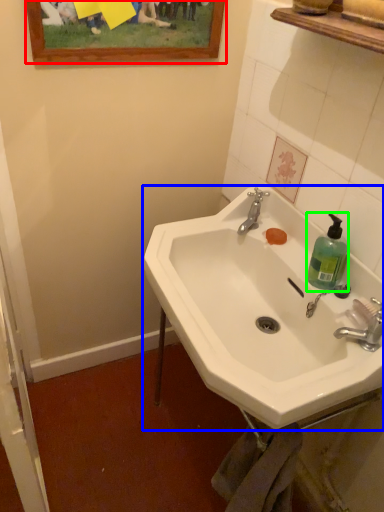
Question: Which is farther away from picture frame (highlighted by a red box)? sink (highlighted by a blue box) or soap dispenser (highlighted by a green box)?

Choices:
 (A) sink
 (B) soap dispenser

Answer: (B)